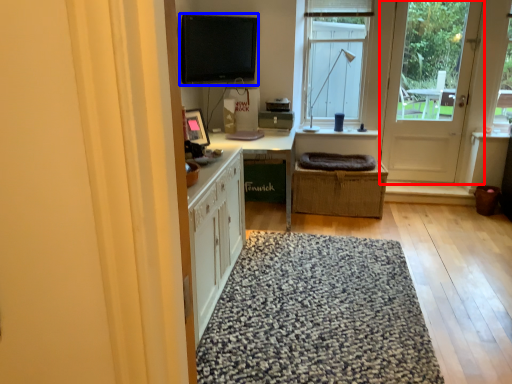
Question: Which object appears closest to the camera in this image, door (highlighted by a red box) or computer monitor (highlighted by a blue box)?

Choices:
 (A) door
 (B) computer monitor

Answer: (B)